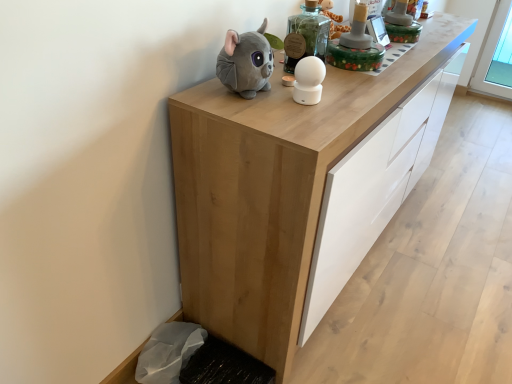
Where is `vacant space in front of soft gray plush toy at upper center, the 1th toy positioned from the left`? vacant space in front of soft gray plush toy at upper center, the 1th toy positioned from the left is located at coordinates (264, 117).